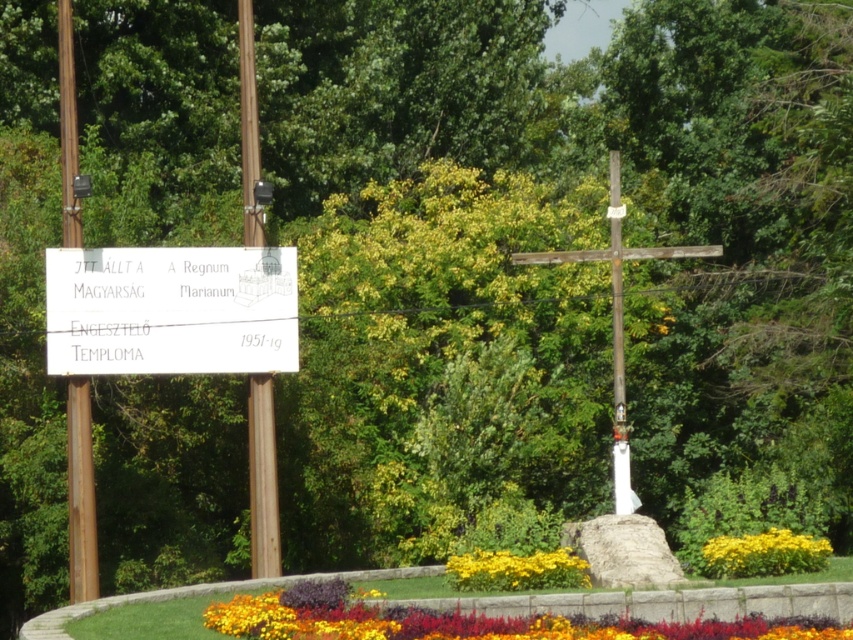
Which is above, white paper sign at upper left or brown wooden signpost at left?

white paper sign at upper left

Can you confirm if white paper sign at upper left is positioned below brown wooden signpost at left?

Actually, white paper sign at upper left is above brown wooden signpost at left.

Find the location of a particular element. white paper sign at upper left is located at coordinates (170, 310).

In order to click on white paper sign at upper left in this screenshot , I will do `click(170, 310)`.

Looking at this image, can you confirm if white paper sign at upper left is smaller than multicolored fabric flowers at lower center?

No.

Where is `white paper sign at upper left`? Image resolution: width=853 pixels, height=640 pixels. white paper sign at upper left is located at coordinates (170, 310).

Who is more forward, (61, 40) or (786, 545)?

Point (786, 545)

Does brown wooden signpost at left have a lesser height compared to yellow matte flower at lower right?

No.

Which is in front, point (79, 420) or point (759, 532)?

Point (759, 532) is in front.

Find the location of `brown wooden signpost at left`. brown wooden signpost at left is located at coordinates (80, 493).